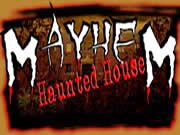
At what (x,y) coordinates should I click in order to perform the action: click on window. Please return your answer as a coordinate pair (x, y). The height and width of the screenshot is (135, 180). Looking at the image, I should click on (68, 68).